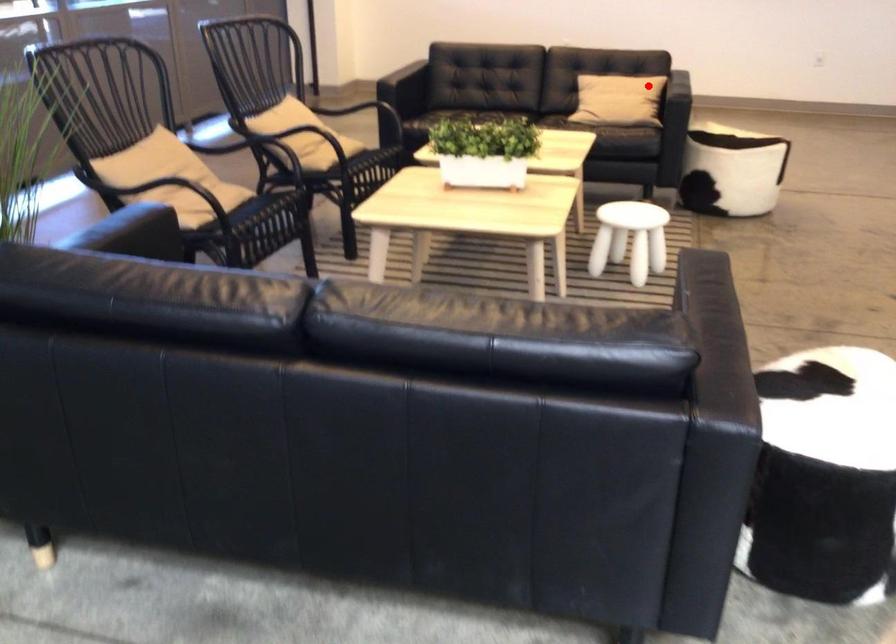
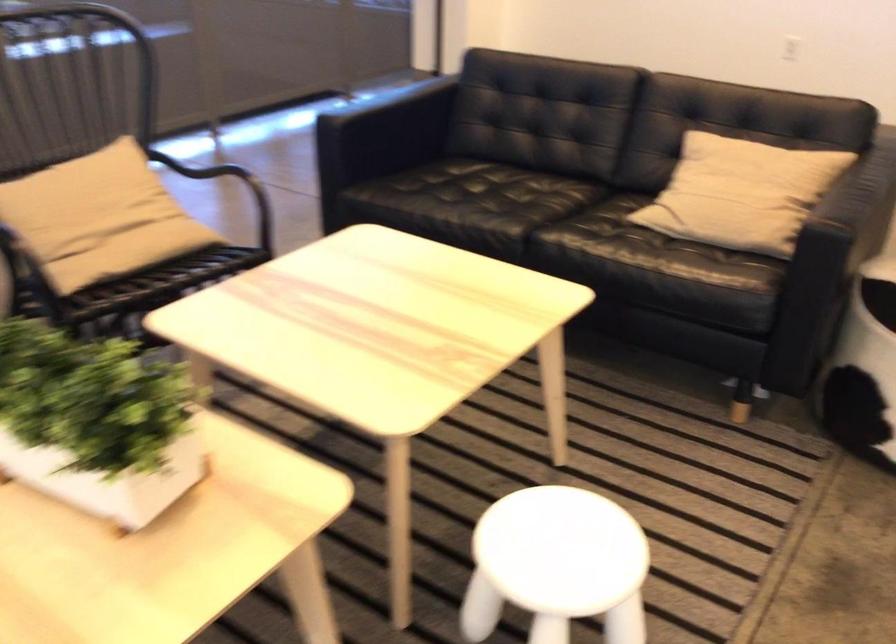
In the second image, find the point that corresponds to the highlighted location in the first image.

(741, 193)